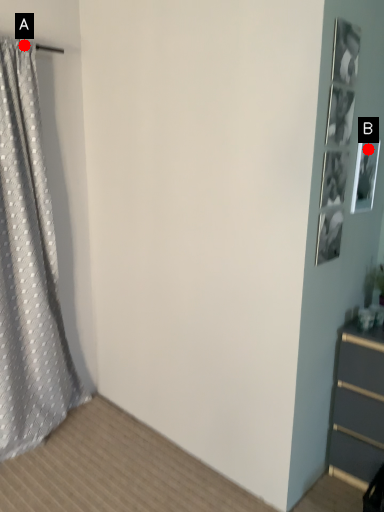
Question: Two points are circled on the image, labeled by A and B beside each circle. Which point appears closest to the camera in this image?

Choices:
 (A) A is closer
 (B) B is closer

Answer: (B)